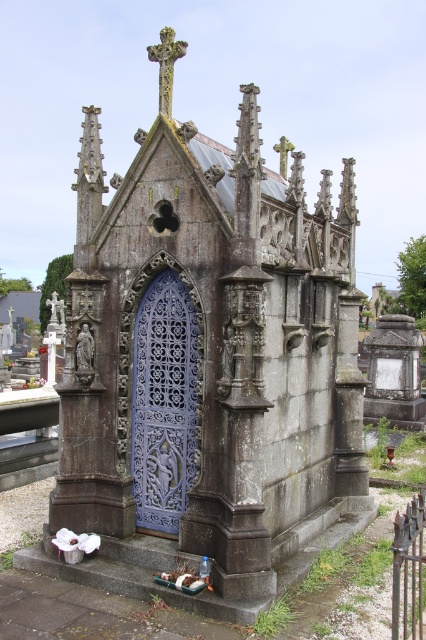
You are standing in a cemetery and want to take a photo of the rusty stone mausoleum at center. Your camera has a maximum focus range of 6 meters. Will you be able to capture the mausoleum clearly without moving closer?

The rusty stone mausoleum at center is 6.57 meters away from the viewer. Since the camera can only focus up to 6 meters, you will not be able to capture it clearly without moving closer.

You are an architect assessing the structural integrity of the rusty stone mausoleum at center and the blue metallic door at center. Which of the two has a greater width?

The rusty stone mausoleum at center has a greater width than the blue metallic door at center, as stated in the description that the mausoleum surpasses the door in width.